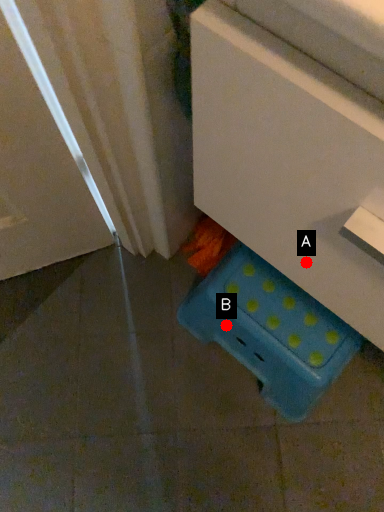
Question: Two points are circled on the image, labeled by A and B beside each circle. Which point is farther to the camera?

Choices:
 (A) A is further
 (B) B is further

Answer: (B)